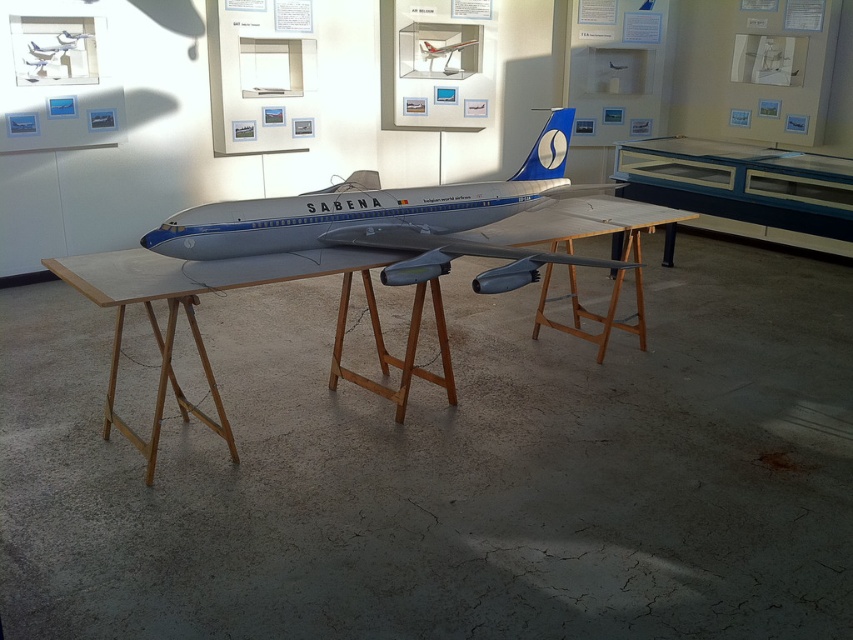
Does wooden at center have a greater height compared to matte silver airplane at center?

In fact, wooden at center may be shorter than matte silver airplane at center.

Who is lower down, wooden at center or matte silver airplane at center?

Positioned lower is wooden at center.

Who is more forward, (437, 310) or (248, 220)?

Positioned in front is point (248, 220).

Locate an element on the screen. wooden at center is located at coordinates (231, 289).

Does wooden at center appear under matte silver airplane at upper center?

Yes, wooden at center is below matte silver airplane at upper center.

Is point (344, 305) more distant than point (453, 72)?

No, (344, 305) is in front of (453, 72).

Locate an element on the screen. This screenshot has height=640, width=853. wooden at center is located at coordinates (231, 289).

Based on the photo, can you confirm if wooden at center is positioned to the left of transparent glass display case at center?

Correct, you'll find wooden at center to the left of transparent glass display case at center.

Who is more forward, (x=111, y=288) or (x=654, y=138)?

Point (x=111, y=288) is more forward.

The height and width of the screenshot is (640, 853). What are the coordinates of `wooden at center` in the screenshot? It's located at (231, 289).